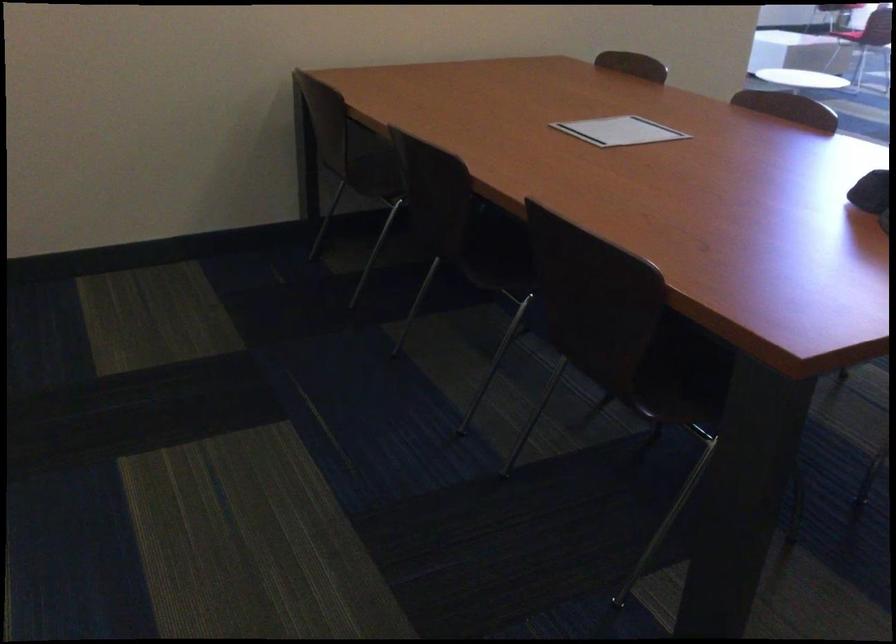
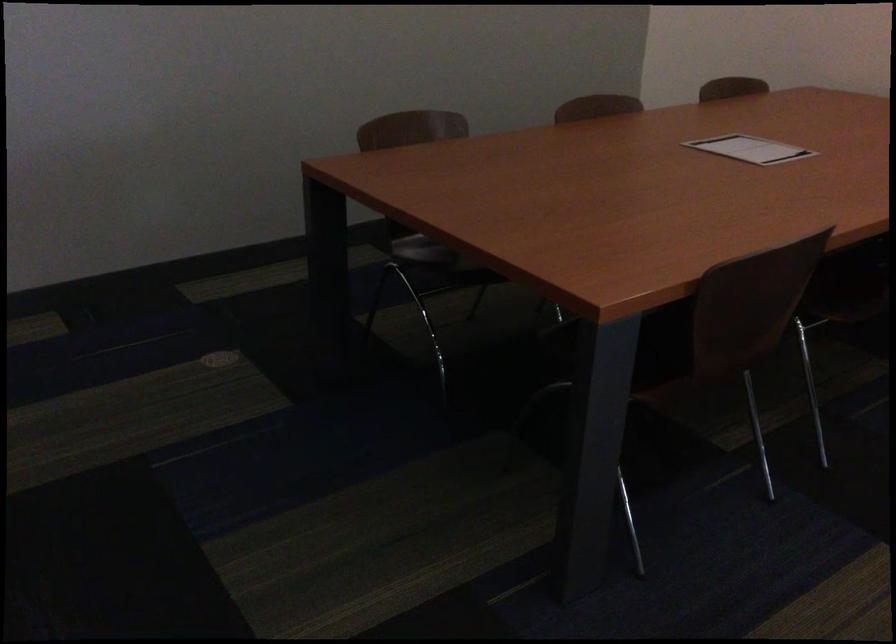
How did the camera likely rotate?

The camera's rotation is toward left-down.